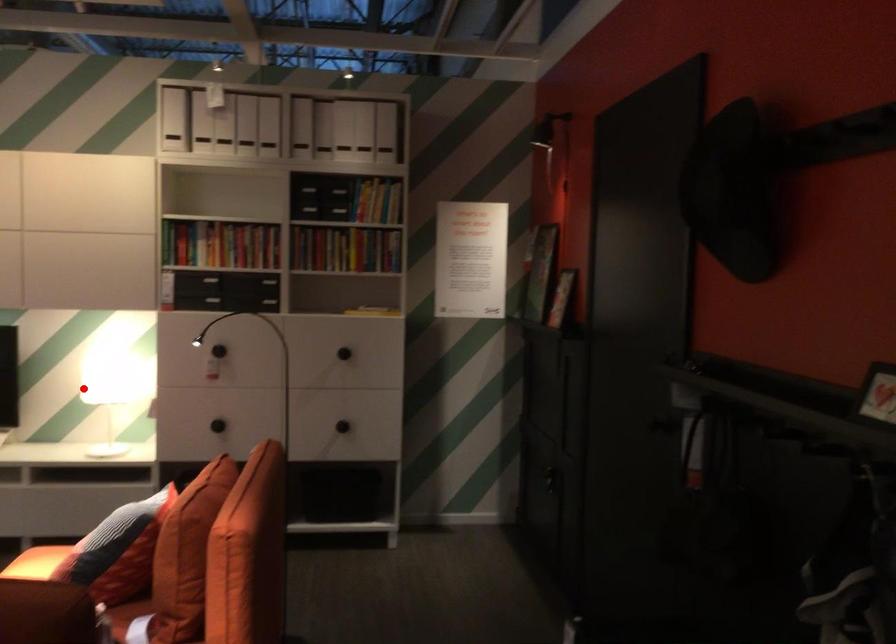
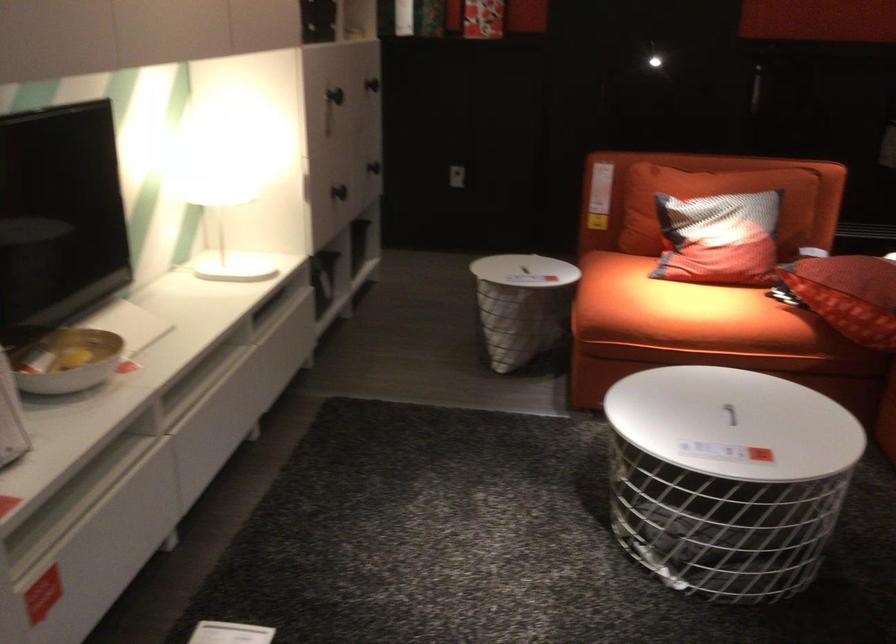
In the second image, find the point that corresponds to the highlighted location in the first image.

(199, 198)